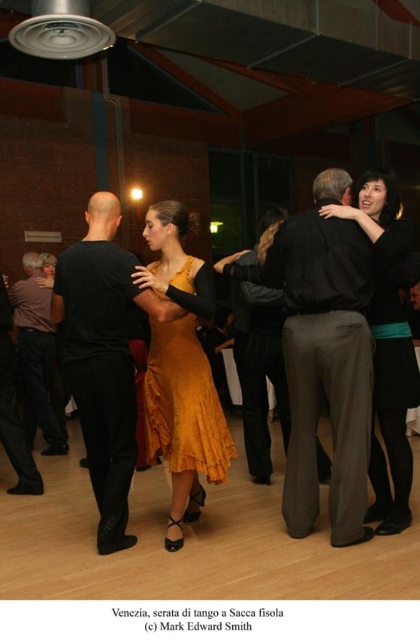
Is brown leather jacket at left above black smooth shirt at left?

Correct, brown leather jacket at left is located above black smooth shirt at left.

Is brown leather jacket at left smaller than black smooth shirt at left?

No, brown leather jacket at left is not smaller than black smooth shirt at left.

Is point (31, 349) in front of point (5, 394)?

No.

I want to click on brown leather jacket at left, so click(37, 356).

Between black matte shirt at center and black smooth shirt at left, which one is positioned higher?

black matte shirt at center

Who is more forward, (91, 228) or (7, 372)?

Point (91, 228) is more forward.

You are a GUI agent. You are given a task and a screenshot of the screen. Output one action in this format:
    pyautogui.click(x=<x>, y=<y>)
    Task: Click on the black matte shirt at center
    This screenshot has width=420, height=640.
    Given the screenshot: What is the action you would take?
    pyautogui.click(x=102, y=358)

Who is higher up, dark gray trousers at center or brown leather jacket at left?

dark gray trousers at center is higher up.

Is dark gray trousers at center positioned in front of brown leather jacket at left?

Yes, dark gray trousers at center is closer to the viewer.

Image resolution: width=420 pixels, height=640 pixels. What are the coordinates of `dark gray trousers at center` in the screenshot? It's located at (322, 355).